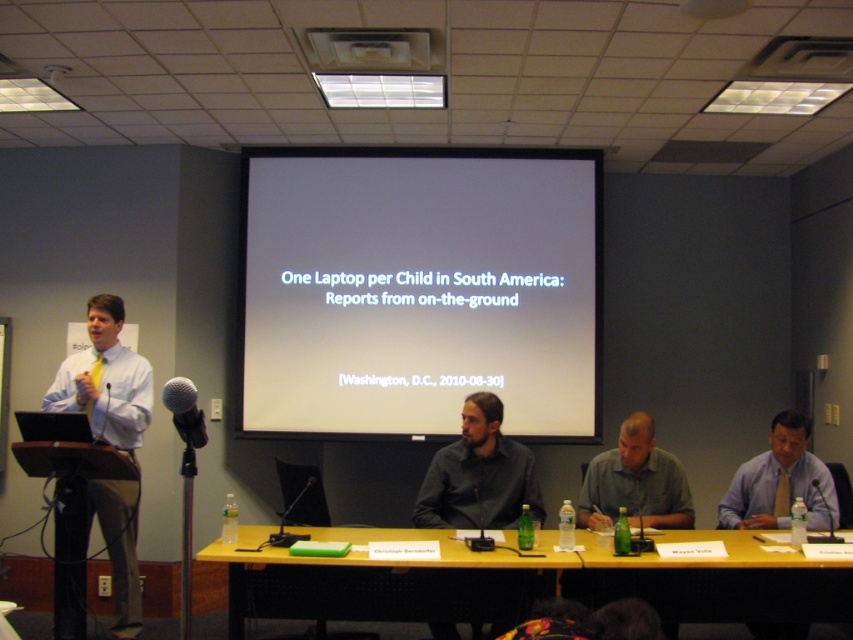
Is point (91, 432) in front of point (740, 470)?

Yes, point (91, 432) is in front of point (740, 470).

Is white shirt at left thinner than light blue shirt at center?

No.

Measure the distance between point [126,499] and camera.

Point [126,499] and camera are 13.27 feet apart from each other.

In order to click on white shirt at left in this screenshot , I will do `click(105, 380)`.

Between white matte projection screen at center and light blue shirt at center, which one has less height?

With less height is light blue shirt at center.

Who is more forward, (268,189) or (807,426)?

Point (807,426) is more forward.

Locate an element on the screen. The height and width of the screenshot is (640, 853). white matte projection screen at center is located at coordinates (421, 291).

Which is more to the right, white shirt at left or gray shirt at center?

gray shirt at center

Is white shirt at left bigger than gray shirt at center?

Yes, white shirt at left is bigger than gray shirt at center.

Is point (105, 401) closer to camera compared to point (643, 486)?

That is False.

The image size is (853, 640). Identify the location of white shirt at left. (105, 380).